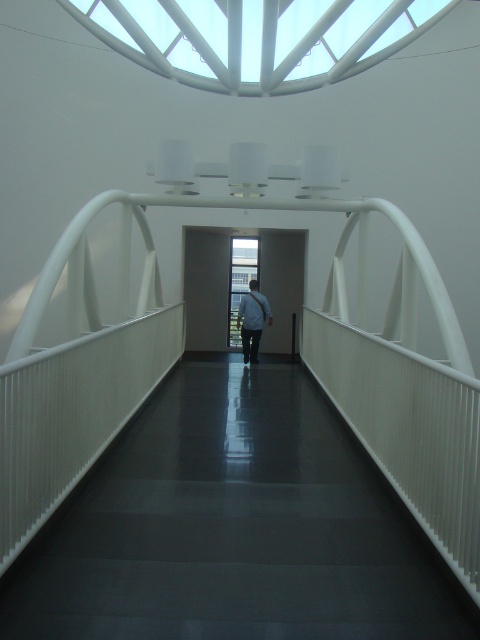
You are a delivery person carrying a white fabric bag at center and need to walk along the black glossy path at center. Is the path clear for you to proceed forward?

The black glossy path at center is in front of the white fabric bag at center, so the path is clear for you to proceed forward.

You are a delivery person carrying a white fabric bag at center and need to walk along the black glossy path at center. Which direction should you move to stay on the path?

The black glossy path at center is positioned on the right side of the white fabric bag at center. To stay on the path, you should move to the right side of the white fabric bag at center.

You are navigating a corridor with white railings on both sides. There are two points marked in the corridor. The first point is at coordinates point (208, 572) and the second point is at point (243, 298). If you are facing the direction of the corridor, which point is closer to you?

Point (208, 572) is in front of point (243, 298), so the point closer to you when facing the corridor is point (208, 572).